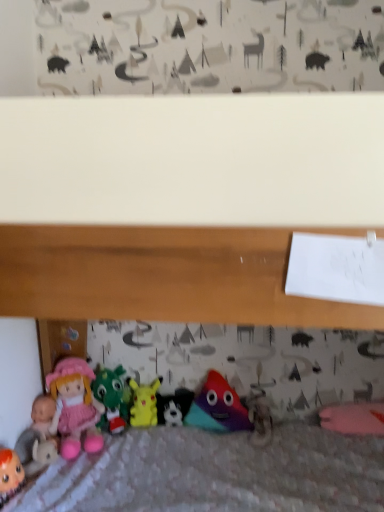
Where is `velvety green dragon at center, which appears as the fourth toy when viewed from the right`? Image resolution: width=384 pixels, height=512 pixels. velvety green dragon at center, which appears as the fourth toy when viewed from the right is located at coordinates (112, 399).

The image size is (384, 512). What do you see at coordinates (39, 434) in the screenshot? I see `matte pink doll at lower left, which ranks as the 5th toy in right-to-left order` at bounding box center [39, 434].

Where is `matte plastic toy at center, which appears as the first toy when viewed from the right`? This screenshot has width=384, height=512. matte plastic toy at center, which appears as the first toy when viewed from the right is located at coordinates (218, 407).

This screenshot has width=384, height=512. Find the location of `matte pink fabric doll at lower left`. matte pink fabric doll at lower left is located at coordinates (75, 407).

Is matte pink fabric doll at lower left not within velvety green dragon at center, the 2th toy when ordered from left to right?

Yes.

Does point (87, 426) appear closer or farther from the camera than point (118, 412)?

Point (87, 426) is closer to the camera than point (118, 412).

Can you confirm if matte pink fabric doll at lower left is smaller than velvety green dragon at center, the 2th toy when ordered from left to right?

No.

Is matte pink fabric doll at lower left wider or thinner than velvety green dragon at center, which appears as the fourth toy when viewed from the right?

matte pink fabric doll at lower left is wider than velvety green dragon at center, which appears as the fourth toy when viewed from the right.

What's the angular difference between black plush toy at center, the 2th toy when ordered from right to left, and matte plastic toy at center, which appears as the first toy when viewed from the right,'s facing directions?

There is a 0.208-degree angle between the facing directions of black plush toy at center, the 2th toy when ordered from right to left, and matte plastic toy at center, which appears as the first toy when viewed from the right.

Is black plush toy at center, the 2th toy when ordered from right to left, oriented away from matte plastic toy at center, the fifth toy when ordered from left to right?

No, black plush toy at center, the 2th toy when ordered from right to left, is not facing away from matte plastic toy at center, the fifth toy when ordered from left to right.

How distant is black plush toy at center, arranged as the fourth toy when viewed from the left, from matte plastic toy at center, which appears as the first toy when viewed from the right?

A distance of 4.78 inches exists between black plush toy at center, arranged as the fourth toy when viewed from the left, and matte plastic toy at center, which appears as the first toy when viewed from the right.

Between black plush toy at center, arranged as the fourth toy when viewed from the left, and matte plastic toy at center, which appears as the first toy when viewed from the right, which one has smaller size?

black plush toy at center, arranged as the fourth toy when viewed from the left.

The height and width of the screenshot is (512, 384). What are the coordinates of `toy that is the 1st object located in front of the black plush toy at center, the 2th toy when ordered from right to left` in the screenshot? It's located at (144, 403).

Does point (152, 415) appear closer or farther from the camera than point (188, 397)?

Point (152, 415) is closer to the camera than point (188, 397).

Is black plush toy at center, the 2th toy when ordered from right to left, surrounded by yellow matte pikachu at center, acting as the 3th toy starting from the right?

No, black plush toy at center, the 2th toy when ordered from right to left, is located outside of yellow matte pikachu at center, acting as the 3th toy starting from the right.

Considering the relative positions of yellow matte pikachu at center, the 3th toy positioned from the left, and black plush toy at center, the 2th toy when ordered from right to left, in the image provided, is yellow matte pikachu at center, the 3th toy positioned from the left, to the right of black plush toy at center, the 2th toy when ordered from right to left, from the viewer's perspective?

Answer: No.

From the image's perspective, would you say matte pink doll at lower left, which ranks as the 5th toy in right-to-left order, is positioned over velvety green dragon at center, the 2th toy when ordered from left to right?

No.

Could you measure the distance between matte pink doll at lower left, which ranks as the 5th toy in right-to-left order, and velvety green dragon at center, the 2th toy when ordered from left to right?

matte pink doll at lower left, which ranks as the 5th toy in right-to-left order, and velvety green dragon at center, the 2th toy when ordered from left to right, are 10.11 inches apart.

Are matte pink doll at lower left, the first toy positioned from the left, and velvety green dragon at center, which appears as the fourth toy when viewed from the right, making contact?

matte pink doll at lower left, the first toy positioned from the left, is not next to velvety green dragon at center, which appears as the fourth toy when viewed from the right, and they're not touching.

Is point (27, 462) closer or farther from the camera than point (127, 411)?

Point (27, 462) is positioned closer to the camera compared to point (127, 411).

Considering the relative sizes of yellow matte pikachu at center, acting as the 3th toy starting from the right, and velvety green dragon at center, the 2th toy when ordered from left to right, in the image provided, is yellow matte pikachu at center, acting as the 3th toy starting from the right, shorter than velvety green dragon at center, the 2th toy when ordered from left to right,?

Indeed, yellow matte pikachu at center, acting as the 3th toy starting from the right, has a lesser height compared to velvety green dragon at center, the 2th toy when ordered from left to right.

Is there a large distance between yellow matte pikachu at center, acting as the 3th toy starting from the right, and velvety green dragon at center, the 2th toy when ordered from left to right?

Actually, yellow matte pikachu at center, acting as the 3th toy starting from the right, and velvety green dragon at center, the 2th toy when ordered from left to right, are a little close together.

Where is `the 2nd toy positioned below the velvety green dragon at center, which appears as the fourth toy when viewed from the right (from a real-world perspective)`? This screenshot has height=512, width=384. the 2nd toy positioned below the velvety green dragon at center, which appears as the fourth toy when viewed from the right (from a real-world perspective) is located at coordinates (144, 403).

Between yellow matte pikachu at center, acting as the 3th toy starting from the right, and velvety green dragon at center, which appears as the fourth toy when viewed from the right, which one appears on the left side from the viewer's perspective?

From the viewer's perspective, velvety green dragon at center, which appears as the fourth toy when viewed from the right, appears more on the left side.

Does black plush toy at center, arranged as the fourth toy when viewed from the left, appear on the left side of yellow matte pikachu at center, the 3th toy positioned from the left?

In fact, black plush toy at center, arranged as the fourth toy when viewed from the left, is to the right of yellow matte pikachu at center, the 3th toy positioned from the left.

Is black plush toy at center, the 2th toy when ordered from right to left, turned away from yellow matte pikachu at center, acting as the 3th toy starting from the right?

No, black plush toy at center, the 2th toy when ordered from right to left,'s orientation is not away from yellow matte pikachu at center, acting as the 3th toy starting from the right.

Looking at their sizes, would you say black plush toy at center, the 2th toy when ordered from right to left, is wider or thinner than yellow matte pikachu at center, the 3th toy positioned from the left?

black plush toy at center, the 2th toy when ordered from right to left, is thinner than yellow matte pikachu at center, the 3th toy positioned from the left.

Considering the relative sizes of black plush toy at center, arranged as the fourth toy when viewed from the left, and yellow matte pikachu at center, acting as the 3th toy starting from the right, in the image provided, is black plush toy at center, arranged as the fourth toy when viewed from the left, taller than yellow matte pikachu at center, acting as the 3th toy starting from the right,?

In fact, black plush toy at center, arranged as the fourth toy when viewed from the left, may be shorter than yellow matte pikachu at center, acting as the 3th toy starting from the right.

From the image's perspective, between velvety green dragon at center, which appears as the fourth toy when viewed from the right, and black plush toy at center, arranged as the fourth toy when viewed from the left, which one is located above?

velvety green dragon at center, which appears as the fourth toy when viewed from the right, from the image's perspective.

Locate an element on the screen. toy that is the 4th one above the black plush toy at center, the 2th toy when ordered from right to left (from a real-world perspective) is located at coordinates (112, 399).

Between velvety green dragon at center, the 2th toy when ordered from left to right, and black plush toy at center, arranged as the fourth toy when viewed from the left, which one has larger size?

With larger size is velvety green dragon at center, the 2th toy when ordered from left to right.

Would you say velvety green dragon at center, the 2th toy when ordered from left to right, contains black plush toy at center, arranged as the fourth toy when viewed from the left?

No.

Where is `the 1st toy below the matte pink fabric doll at lower left (from the image's perspective)`? the 1st toy below the matte pink fabric doll at lower left (from the image's perspective) is located at coordinates (112, 399).

You are a GUI agent. You are given a task and a screenshot of the screen. Output one action in this format:
    pyautogui.click(x=<x>, y=<y>)
    Task: Click on the 2nd toy behind the matte plastic toy at center, which appears as the first toy when viewed from the right
    This screenshot has height=512, width=384.
    Given the screenshot: What is the action you would take?
    pyautogui.click(x=174, y=407)

When comparing their distances from matte plastic toy at center, the fifth toy when ordered from left to right, does matte pink doll at lower left, the first toy positioned from the left, or black plush toy at center, arranged as the fourth toy when viewed from the left, seem further?

matte pink doll at lower left, the first toy positioned from the left.

Based on their spatial positions, is yellow matte pikachu at center, acting as the 3th toy starting from the right, or velvety green dragon at center, which appears as the fourth toy when viewed from the right, closer to matte plastic toy at center, the fifth toy when ordered from left to right?

Among the two, yellow matte pikachu at center, acting as the 3th toy starting from the right, is located nearer to matte plastic toy at center, the fifth toy when ordered from left to right.

Estimate the real-world distances between objects in this image. Which object is closer to yellow matte pikachu at center, acting as the 3th toy starting from the right, matte pink doll at lower left, which ranks as the 5th toy in right-to-left order, or matte plastic toy at center, the fifth toy when ordered from left to right?

matte plastic toy at center, the fifth toy when ordered from left to right, is closer to yellow matte pikachu at center, acting as the 3th toy starting from the right.

From the image, which object appears to be nearer to matte pink doll at lower left, the first toy positioned from the left, velvety green dragon at center, the 2th toy when ordered from left to right, or yellow matte pikachu at center, acting as the 3th toy starting from the right?

The object closer to matte pink doll at lower left, the first toy positioned from the left, is velvety green dragon at center, the 2th toy when ordered from left to right.

Which object lies nearer to the anchor point matte pink fabric doll at lower left, matte pink doll at lower left, the first toy positioned from the left, or matte plastic toy at center, which appears as the first toy when viewed from the right?

The object closer to matte pink fabric doll at lower left is matte pink doll at lower left, the first toy positioned from the left.

Based on their spatial positions, is matte plastic toy at center, the fifth toy when ordered from left to right, or velvety green dragon at center, which appears as the fourth toy when viewed from the right, further from matte pink fabric doll at lower left?

Among the two, matte plastic toy at center, the fifth toy when ordered from left to right, is located further to matte pink fabric doll at lower left.

From the image, which object appears to be nearer to matte plastic toy at center, the fifth toy when ordered from left to right, black plush toy at center, the 2th toy when ordered from right to left, or matte pink doll at lower left, which ranks as the 5th toy in right-to-left order?

Based on the image, black plush toy at center, the 2th toy when ordered from right to left, appears to be nearer to matte plastic toy at center, the fifth toy when ordered from left to right.

Looking at this image, when comparing their distances from yellow matte pikachu at center, acting as the 3th toy starting from the right, does velvety green dragon at center, the 2th toy when ordered from left to right, or matte pink fabric doll at lower left seem further?

matte pink fabric doll at lower left is positioned further to the anchor yellow matte pikachu at center, acting as the 3th toy starting from the right.

The width and height of the screenshot is (384, 512). I want to click on toy between matte pink doll at lower left, the first toy positioned from the left, and yellow matte pikachu at center, acting as the 3th toy starting from the right, from left to right, so click(x=112, y=399).

Find the location of a particular element. doll between matte pink doll at lower left, which ranks as the 5th toy in right-to-left order, and velvety green dragon at center, the 2th toy when ordered from left to right, in the horizontal direction is located at coordinates (75, 407).

Where is `doll situated between matte pink doll at lower left, which ranks as the 5th toy in right-to-left order, and black plush toy at center, the 2th toy when ordered from right to left, from left to right`? This screenshot has width=384, height=512. doll situated between matte pink doll at lower left, which ranks as the 5th toy in right-to-left order, and black plush toy at center, the 2th toy when ordered from right to left, from left to right is located at coordinates (75, 407).

Identify the location of toy situated between yellow matte pikachu at center, the 3th toy positioned from the left, and matte plastic toy at center, the fifth toy when ordered from left to right, from left to right. The width and height of the screenshot is (384, 512). (174, 407).